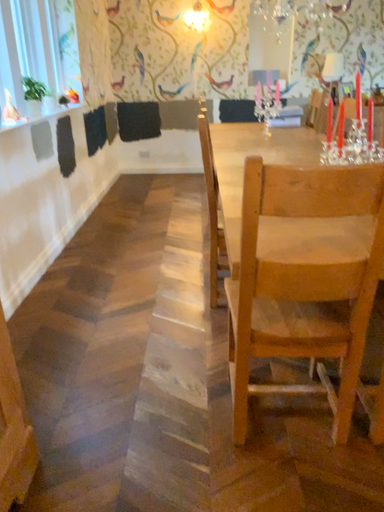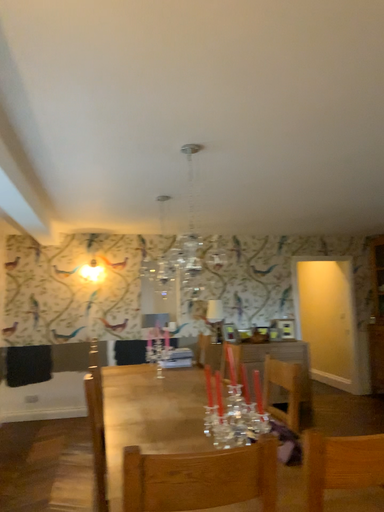
Question: How did the camera likely rotate when shooting the video?

Choices:
 (A) rotated right
 (B) rotated left

Answer: (A)